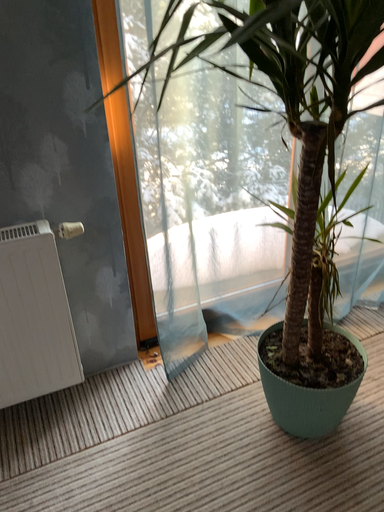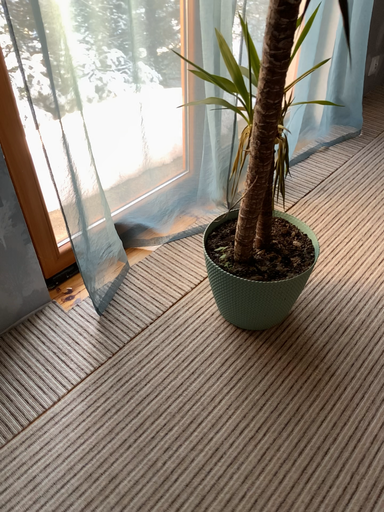
Question: How did the camera likely rotate when shooting the video?

Choices:
 (A) rotated left
 (B) rotated right

Answer: (B)